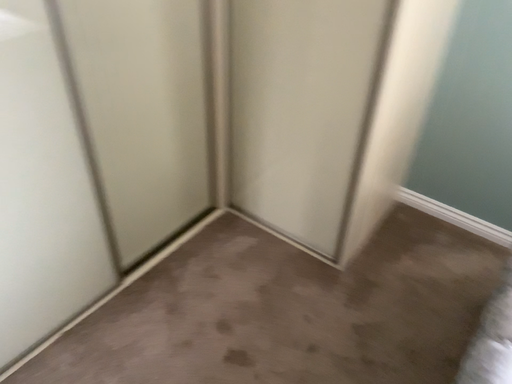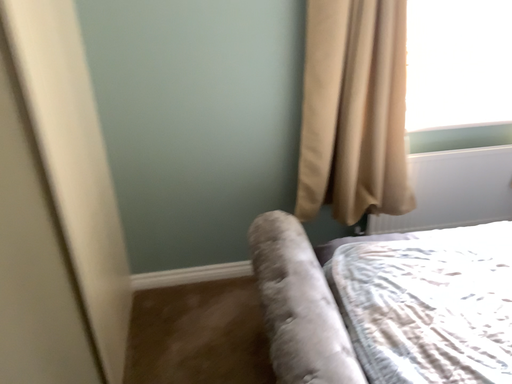
Question: How did the camera likely rotate when shooting the video?

Choices:
 (A) rotated upward
 (B) rotated downward

Answer: (A)